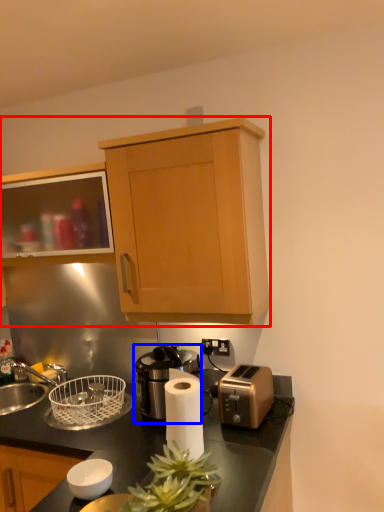
Question: Which of the following is the closest to the observer, cabinetry (highlighted by a red box) or coffee machine (highlighted by a blue box)?

Choices:
 (A) cabinetry
 (B) coffee machine

Answer: (A)